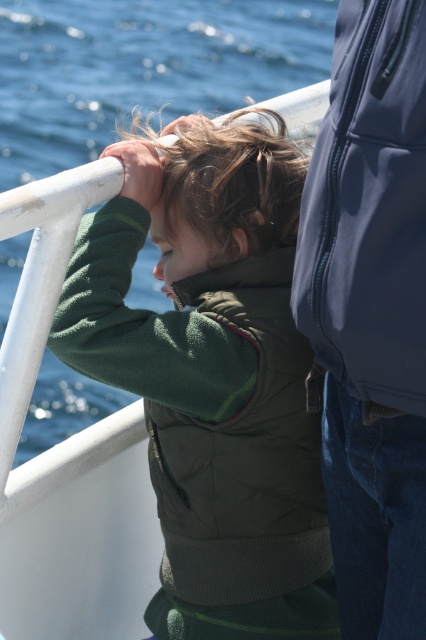
Can you confirm if green fleece jacket at center is positioned to the right of glossy blue jacket at upper right?

In fact, green fleece jacket at center is to the left of glossy blue jacket at upper right.

Is point (233, 628) less distant than point (406, 308)?

No.

Find the location of a particular element. The width and height of the screenshot is (426, 640). green fleece jacket at center is located at coordinates (213, 378).